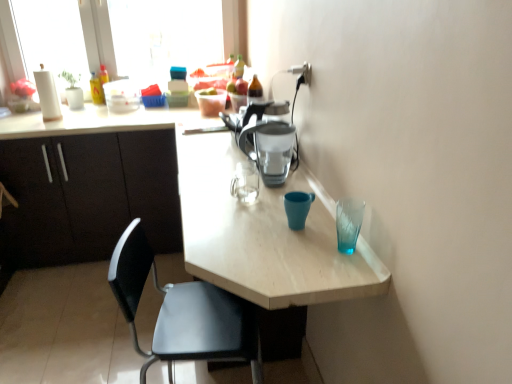
Question: Is matte black cabinets at left completely or partially inside black plastic chair at lower left?

Choices:
 (A) no
 (B) yes

Answer: (A)

Question: Would you consider black plastic chair at lower left to be distant from matte black cabinets at left?

Choices:
 (A) yes
 (B) no

Answer: (A)

Question: Would you say black plastic chair at lower left is outside matte black cabinets at left?

Choices:
 (A) no
 (B) yes

Answer: (B)

Question: Is black plastic chair at lower left further to camera compared to matte black cabinets at left?

Choices:
 (A) no
 (B) yes

Answer: (A)

Question: Does black plastic chair at lower left have a greater width compared to matte black cabinets at left?

Choices:
 (A) yes
 (B) no

Answer: (B)

Question: Considering the positions of light wood table at center and black plastic chair at lower left in the image, is light wood table at center taller or shorter than black plastic chair at lower left?

Choices:
 (A) tall
 (B) short

Answer: (A)

Question: Looking at their shapes, would you say light wood table at center is wider or thinner than black plastic chair at lower left?

Choices:
 (A) wide
 (B) thin

Answer: (A)

Question: Considering their positions, is light wood table at center located in front of or behind black plastic chair at lower left?

Choices:
 (A) behind
 (B) front

Answer: (B)

Question: From the image's perspective, is light wood table at center above or below black plastic chair at lower left?

Choices:
 (A) above
 (B) below

Answer: (A)

Question: Based on their positions, is light wood table at center located to the left or right of matte plastic coffee pot at center?

Choices:
 (A) right
 (B) left

Answer: (B)

Question: Based on their sizes in the image, would you say light wood table at center is bigger or smaller than matte plastic coffee pot at center?

Choices:
 (A) small
 (B) big

Answer: (B)

Question: From a real-world perspective, is light wood table at center physically located above or below matte plastic coffee pot at center?

Choices:
 (A) above
 (B) below

Answer: (B)

Question: Considering the positions of light wood table at center and matte plastic coffee pot at center in the image, is light wood table at center wider or thinner than matte plastic coffee pot at center?

Choices:
 (A) wide
 (B) thin

Answer: (A)

Question: From the image's perspective, is black plastic chair at lower left above or below matte plastic coffee pot at center?

Choices:
 (A) above
 (B) below

Answer: (B)

Question: In the image, is black plastic chair at lower left positioned in front of or behind matte plastic coffee pot at center?

Choices:
 (A) behind
 (B) front

Answer: (B)